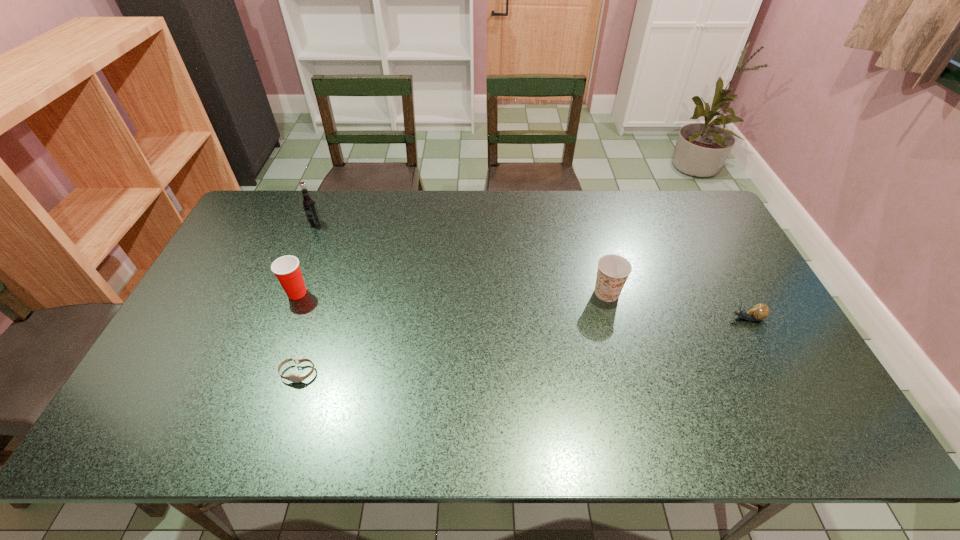
Image resolution: width=960 pixels, height=540 pixels. I want to click on free space that is in between the tallest object and the rightmost object, so click(531, 271).

This screenshot has width=960, height=540. I want to click on vacant area that lies between the farthest object and the right Dixie cup, so click(x=461, y=258).

Find the location of a particular element. empty location between the nearest object and the second object from right to left is located at coordinates [x=452, y=333].

Locate an element on the screen. free space between the farthest object and the shortest object is located at coordinates (306, 298).

Where is `vacant space in between the shortest object and the escargot`? vacant space in between the shortest object and the escargot is located at coordinates (522, 346).

This screenshot has height=540, width=960. I want to click on vacant space in between the fourth tallest object and the nearest object, so click(x=522, y=346).

The height and width of the screenshot is (540, 960). Identify the location of free space between the root beer and the second object from right to left. (461, 258).

Image resolution: width=960 pixels, height=540 pixels. In order to click on free space between the left Dixie cup and the tallest object in this screenshot , I will do [306, 258].

Find the location of a particular element. Image resolution: width=960 pixels, height=540 pixels. free space between the fourth farthest object and the left Dixie cup is located at coordinates (522, 306).

Identify the location of vacant space that's between the left Dixie cup and the root beer. This screenshot has width=960, height=540. (306, 258).